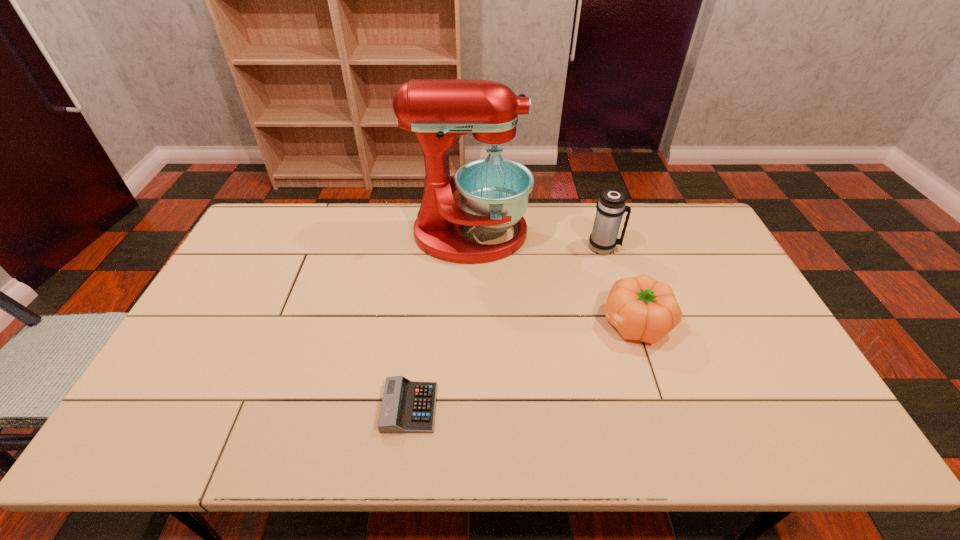
Identify the location of free space located 0.350m on the carved face of the third farthest object. The height and width of the screenshot is (540, 960). (476, 323).

You are a GUI agent. You are given a task and a screenshot of the screen. Output one action in this format:
    pyautogui.click(x=<x>, y=<y>)
    Task: Click on the vacant space located 0.050m on the back of the nearest object
    This screenshot has width=960, height=540.
    Given the screenshot: What is the action you would take?
    pyautogui.click(x=415, y=367)

Locate an element on the screen. Image resolution: width=960 pixels, height=540 pixels. mixer situated at the far edge is located at coordinates pos(493,192).

Locate an element on the screen. thermos bottle present at the far edge is located at coordinates (611, 206).

Identify the location of object located at the near edge. (407, 406).

Find the location of `free spot at the far edge of the desktop`. free spot at the far edge of the desktop is located at coordinates (364, 228).

At what (x,y) coordinates should I click in order to perform the action: click on vacant position at the near edge of the desktop. Please return your answer as a coordinate pair (x, y). The image size is (960, 540). Looking at the image, I should click on (582, 415).

Locate an element on the screen. This screenshot has height=540, width=960. vacant space at the left edge of the desktop is located at coordinates (276, 248).

Locate an element on the screen. The height and width of the screenshot is (540, 960). vacant space at the right edge of the desktop is located at coordinates (728, 322).

I want to click on free space at the far left corner, so coord(297,220).